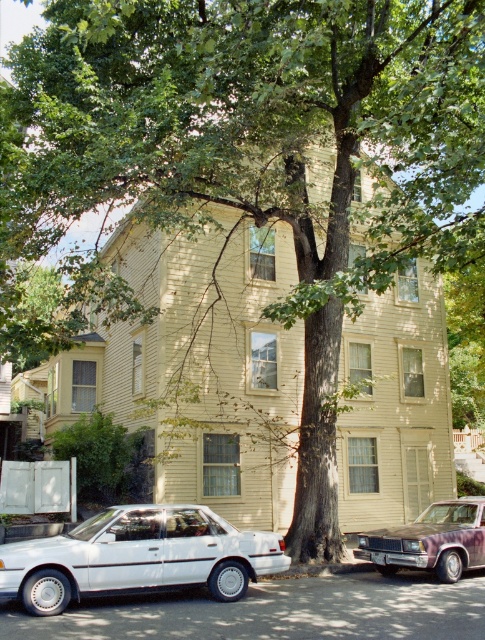
From the picture: Does white matte sedan at lower left have a greater width compared to purple metallic sedan at lower right?

Correct, the width of white matte sedan at lower left exceeds that of purple metallic sedan at lower right.

Between white matte sedan at lower left and purple metallic sedan at lower right, which one has more height?

white matte sedan at lower left is taller.

Locate an element on the screen. This screenshot has height=640, width=485. white matte sedan at lower left is located at coordinates (139, 556).

Locate an element on the screen. Image resolution: width=485 pixels, height=640 pixels. white matte sedan at lower left is located at coordinates (139, 556).